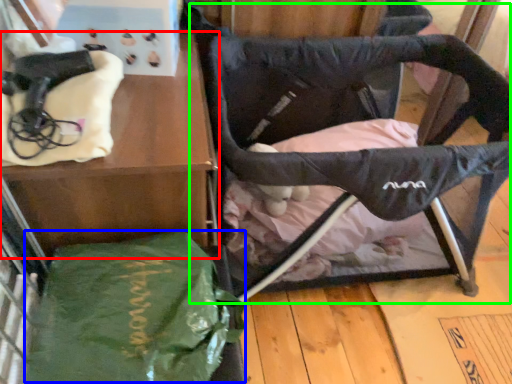
Question: Which object is the farthest from furniture (highlighted by a red box)? Choose among these: tote bag (highlighted by a blue box) or swivel chair (highlighted by a green box).

Choices:
 (A) tote bag
 (B) swivel chair

Answer: (B)